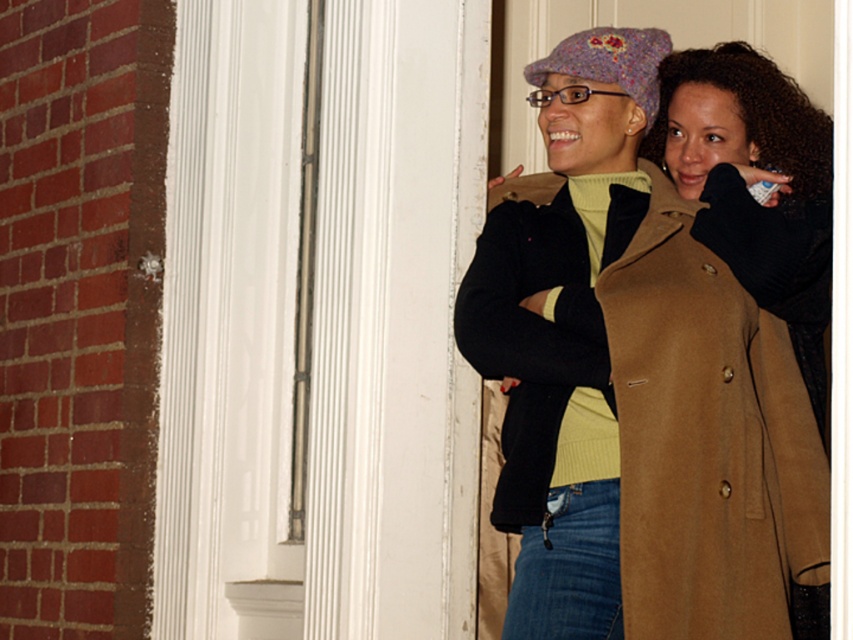
You are a security camera positioned at the top of the door frame. You need to determine if the tan woolen trench coat at center is within the secure zone marked by the rectangle from coordinates 0.6 to 0.8 in both x and y axes. Is it inside?

The tan woolen trench coat at center is located at coordinates 0.689 in x and 0.830 in y. Since the secure zone is defined between 0.6 to 0.8 in both axes, the x coordinate is within range, but the y coordinate is exactly at 0.830, which is slightly above the upper limit of 0.8. Therefore, the tan woolen trench coat at center is just outside the secure zone.

You are trying to decide which coat to take with you on a trip. Both the tan woolen trench coat at center and the brown woolen coat at center are in front of you. Based on their sizes, which one might you choose if you prefer a wider coat?

The tan woolen trench coat at center might be wider than the brown woolen coat at center, so you should choose the tan woolen trench coat at center if you prefer a wider coat.

You are standing in front of the doorway scene. There is a point at coordinates (531, 339). Which object from the scene does this point belong to?

The point at coordinates (531, 339) belongs to the brown woolen coat at center.